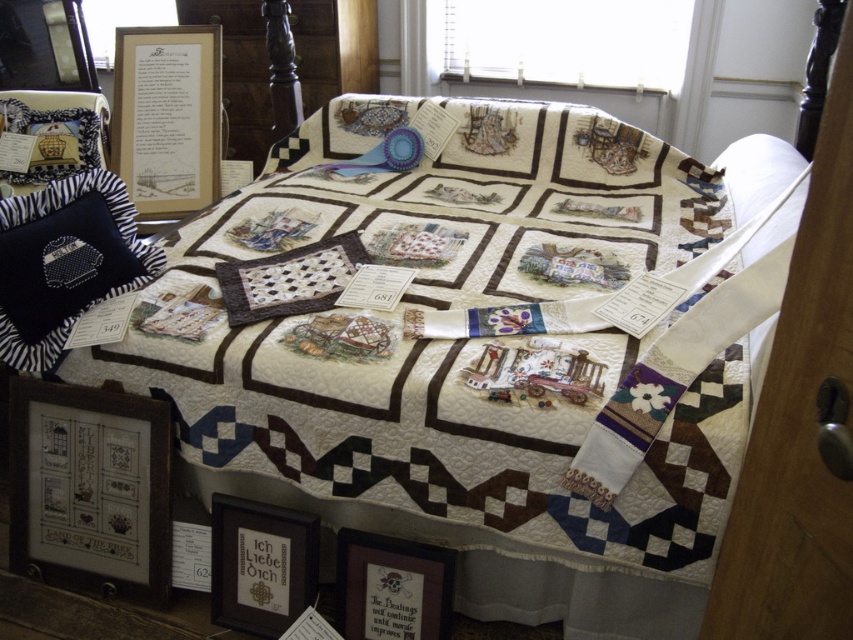
You are an interior designer planning to hang a new picture frame in the bedroom. The existing matte black picture frame at lower center is already placed at coordinates 0.883 on the x axis and 0.307 on the y axis. If you want to place a new frame 0.1 units to the right and 0.05 units higher than the existing one, what would be the new coordinates?

The new coordinates would be x 0.983 and y 0.257.

You are standing in front of the quilt display and want to take a closer look at the matte gold picture frame at upper left. If you can reach up to 1.8 meters, can you comfortably touch the frame without needing a stool?

The matte gold picture frame at upper left is 2.00 meters away from the viewer. Since your maximum reach is 1.8 meters, you cannot comfortably touch the frame without needing a stool.